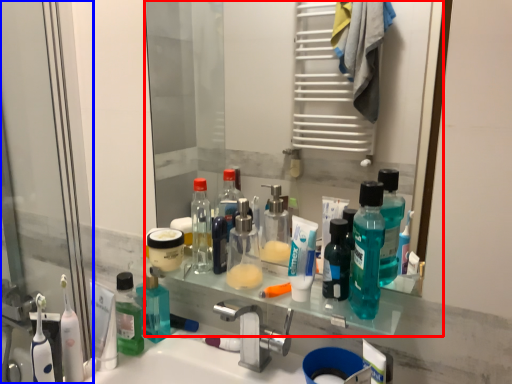
Question: Which object is further to the camera taking this photo, mirror (highlighted by a red box) or screen door (highlighted by a blue box)?

Choices:
 (A) mirror
 (B) screen door

Answer: (B)